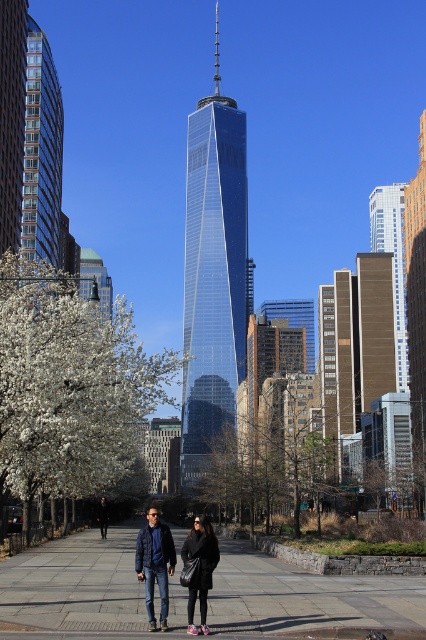
Which is more to the right, shiny glass skyscraper at center or navy blue jacket at center?

Positioned to the right is shiny glass skyscraper at center.

From the picture: Between shiny glass skyscraper at center and navy blue jacket at center, which one has less height?

With less height is navy blue jacket at center.

The width and height of the screenshot is (426, 640). Find the location of `shiny glass skyscraper at center`. shiny glass skyscraper at center is located at coordinates (213, 275).

This screenshot has height=640, width=426. In order to click on shiny glass skyscraper at center in this screenshot , I will do `click(213, 275)`.

Does glassy steel skyscraper at center appear under black leather jacket at center?

Incorrect, glassy steel skyscraper at center is not positioned below black leather jacket at center.

Does point (51, 221) come closer to viewer compared to point (209, 566)?

No, (51, 221) is behind (209, 566).

Which is behind, point (57, 236) or point (195, 540)?

Positioned behind is point (57, 236).

Where is `glassy steel skyscraper at center`? The width and height of the screenshot is (426, 640). glassy steel skyscraper at center is located at coordinates (29, 141).

Who is positioned more to the left, matte black jacket at center or black leather jacket at center?

matte black jacket at center is more to the left.

Which of these two, matte black jacket at center or black leather jacket at center, stands shorter?

black leather jacket at center

Consider the image. Who is more distant from viewer, (149, 541) or (187, 632)?

Point (149, 541)

Identify the location of matte black jacket at center. Image resolution: width=426 pixels, height=640 pixels. (155, 563).